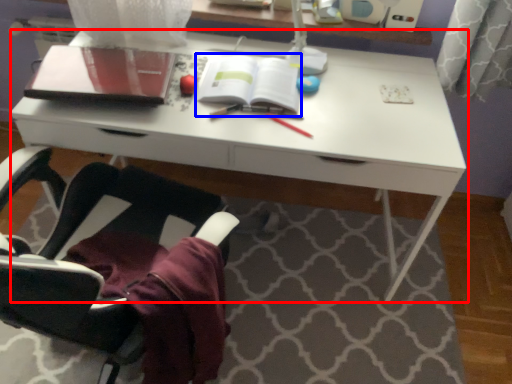
Question: Which object appears closest to the camera in this image, desk (highlighted by a red box) or paperback book (highlighted by a blue box)?

Choices:
 (A) desk
 (B) paperback book

Answer: (A)